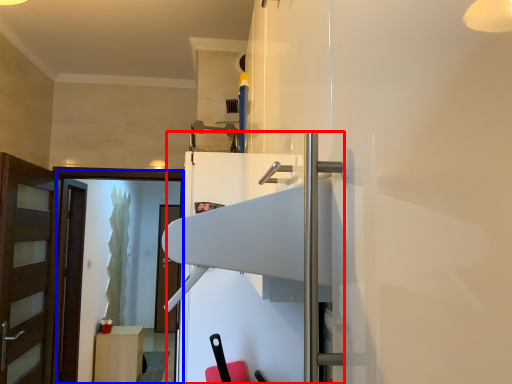
Question: Which of the following is the farthest to the observer, fridge (highlighted by a red box) or screen door (highlighted by a blue box)?

Choices:
 (A) fridge
 (B) screen door

Answer: (B)